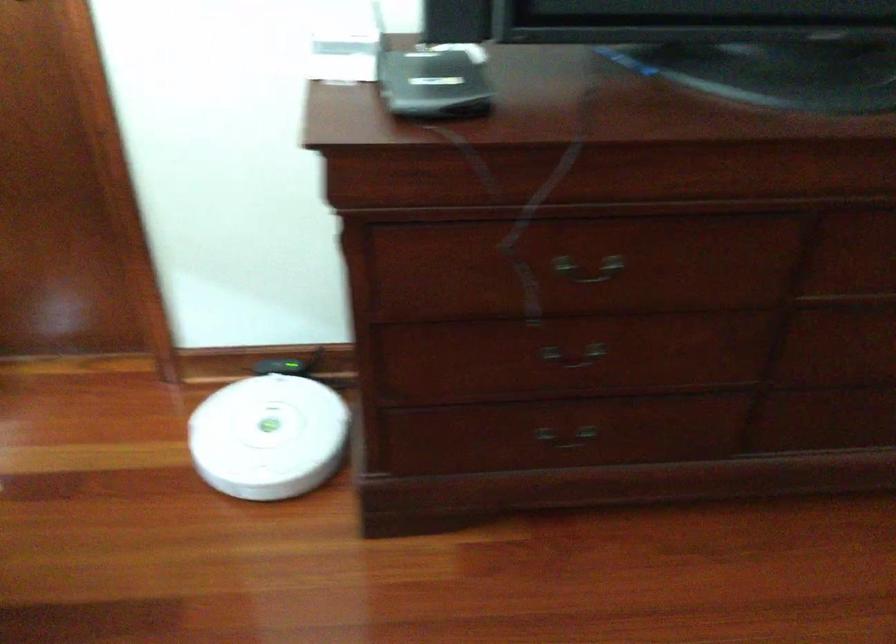
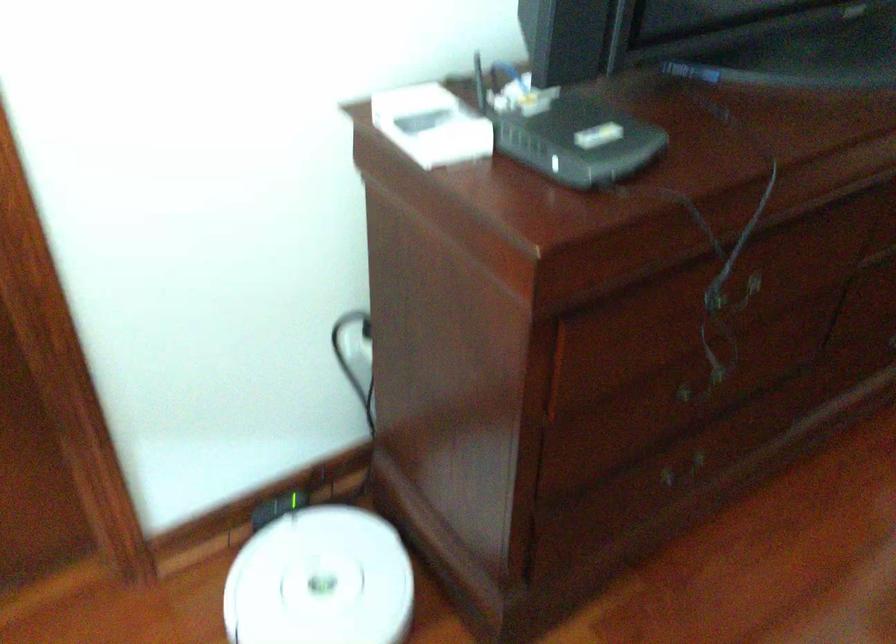
In the second image, find the point that corresponds to pixel 592 361 in the first image.

(702, 384)